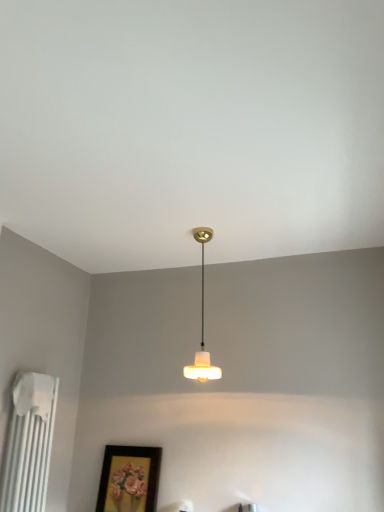
The height and width of the screenshot is (512, 384). Describe the element at coordinates (129, 479) in the screenshot. I see `matte gold picture frame at lower center` at that location.

The image size is (384, 512). Identify the location of matte gold picture frame at lower center. (129, 479).

The height and width of the screenshot is (512, 384). What do you see at coordinates (29, 443) in the screenshot? I see `white matte radiator at left` at bounding box center [29, 443].

At what (x,y) coordinates should I click in order to perform the action: click on matte gold picture frame at lower center. Please return your answer as a coordinate pair (x, y). The width and height of the screenshot is (384, 512). Looking at the image, I should click on (129, 479).

Can you confirm if white frosted glass lampshade at center is thinner than white matte radiator at left?

Incorrect, the width of white frosted glass lampshade at center is not less than that of white matte radiator at left.

Which is more to the right, white frosted glass lampshade at center or white matte radiator at left?

Positioned to the right is white frosted glass lampshade at center.

Is point (201, 357) positioned in front of point (41, 377)?

No, it is behind (41, 377).

Between white frosted glass lampshade at center and white matte radiator at left, which one has more height?

white frosted glass lampshade at center.

Is point (32, 468) closer to camera compared to point (202, 311)?

Yes, it is in front of point (202, 311).

Which is more to the left, white matte radiator at left or white frosted glass lampshade at center?

From the viewer's perspective, white matte radiator at left appears more on the left side.

Identify the location of radiator below the white frosted glass lampshade at center (from a real-world perspective). This screenshot has width=384, height=512. (29, 443).

Is the depth of white frosted glass lampshade at center greater than that of matte gold picture frame at lower center?

No.

Looking at this image, is white frosted glass lampshade at center oriented away from matte gold picture frame at lower center?

white frosted glass lampshade at center is not turned away from matte gold picture frame at lower center.

From a real-world perspective, is white frosted glass lampshade at center above or below matte gold picture frame at lower center?

In terms of real-world spatial position, white frosted glass lampshade at center is above matte gold picture frame at lower center.

How distant is matte gold picture frame at lower center from white matte radiator at left?

matte gold picture frame at lower center is 21.70 inches from white matte radiator at left.

Is matte gold picture frame at lower center placed right next to white matte radiator at left?

matte gold picture frame at lower center is not next to white matte radiator at left, and they're not touching.

Is matte gold picture frame at lower center not inside white matte radiator at left?

matte gold picture frame at lower center is positioned outside white matte radiator at left.

Based on the photo, considering the sizes of objects matte gold picture frame at lower center and white matte radiator at left in the image provided, who is thinner, matte gold picture frame at lower center or white matte radiator at left?

matte gold picture frame at lower center.

Is matte gold picture frame at lower center bigger than white frosted glass lampshade at center?

No.

Is matte gold picture frame at lower center facing away from white frosted glass lampshade at center?

matte gold picture frame at lower center does not have its back to white frosted glass lampshade at center.

From the image's perspective, is matte gold picture frame at lower center under white frosted glass lampshade at center?

Correct, matte gold picture frame at lower center appears lower than white frosted glass lampshade at center in the image.

Is matte gold picture frame at lower center taller or shorter than white frosted glass lampshade at center?

Considering their sizes, matte gold picture frame at lower center has less height than white frosted glass lampshade at center.

Considering the relative sizes of white matte radiator at left and matte gold picture frame at lower center in the image provided, is white matte radiator at left thinner than matte gold picture frame at lower center?

No.

Is white matte radiator at left with matte gold picture frame at lower center?

No, white matte radiator at left is not with matte gold picture frame at lower center.

Find the location of a particular element. This screenshot has height=512, width=384. picture frame below the white matte radiator at left (from a real-world perspective) is located at coordinates (129, 479).

Considering the relative sizes of white matte radiator at left and matte gold picture frame at lower center in the image provided, is white matte radiator at left shorter than matte gold picture frame at lower center?

Incorrect, the height of white matte radiator at left does not fall short of that of matte gold picture frame at lower center.

This screenshot has height=512, width=384. Identify the location of radiator located below the white frosted glass lampshade at center (from the image's perspective). (29, 443).

In the image, there is a white matte radiator at left. Identify the location of lamp above it (from the image's perspective). (202, 325).

Based on their spatial positions, is white matte radiator at left or matte gold picture frame at lower center further from white frosted glass lampshade at center?

Based on the image, white matte radiator at left appears to be further to white frosted glass lampshade at center.

When comparing their distances from white frosted glass lampshade at center, does matte gold picture frame at lower center or white matte radiator at left seem closer?

matte gold picture frame at lower center is positioned closer to the anchor white frosted glass lampshade at center.

When comparing their distances from matte gold picture frame at lower center, does white matte radiator at left or white frosted glass lampshade at center seem further?

white frosted glass lampshade at center is further to matte gold picture frame at lower center.

When comparing their distances from white matte radiator at left, does matte gold picture frame at lower center or white frosted glass lampshade at center seem further?

white frosted glass lampshade at center.

Based on their spatial positions, is white frosted glass lampshade at center or white matte radiator at left closer to matte gold picture frame at lower center?

white matte radiator at left lies closer to matte gold picture frame at lower center than the other object.

Which object lies further to the anchor point white matte radiator at left, white frosted glass lampshade at center or matte gold picture frame at lower center?

white frosted glass lampshade at center is further to white matte radiator at left.

The image size is (384, 512). I want to click on radiator between white frosted glass lampshade at center and matte gold picture frame at lower center vertically, so click(x=29, y=443).